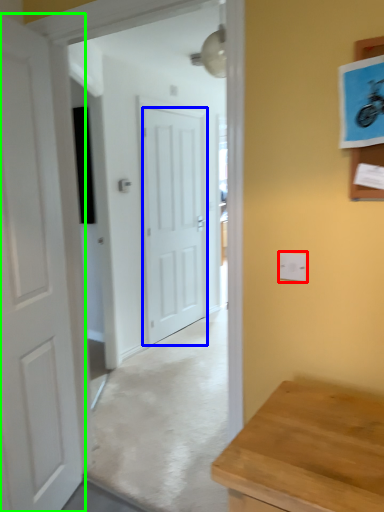
Question: Considering the real-world distances, which object is farthest from electric outlet (highlighted by a red box)? door (highlighted by a blue box) or door (highlighted by a green box)?

Choices:
 (A) door
 (B) door

Answer: (A)